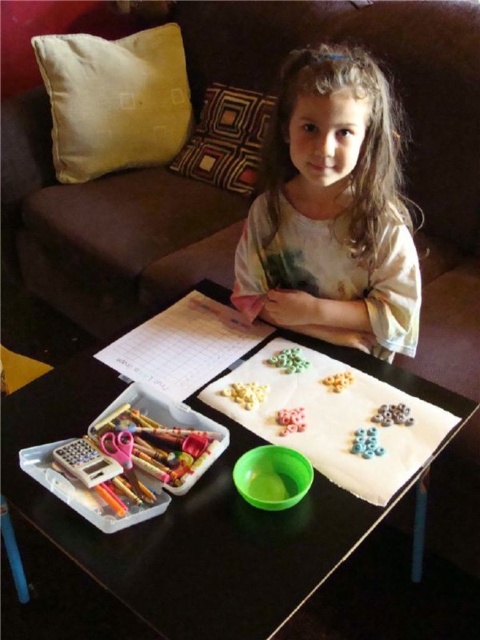
Question: Which point is farther from the camera taking this photo?

Choices:
 (A) (116, 547)
 (B) (372, 346)
 (C) (370, 16)
 (D) (120, 92)

Answer: (D)

Question: In this image, where is velvet brown couch at upper center located relative to green plastic bowl at lower center?

Choices:
 (A) right
 (B) left

Answer: (B)

Question: Which object appears closest to the camera in this image?

Choices:
 (A) beige fabric pillow at upper left
 (B) light brown tie-dye shirt at center
 (C) velvet brown couch at upper center

Answer: (B)

Question: Does green plastic bowl at lower center have a larger size compared to beige fabric pillow at upper left?

Choices:
 (A) yes
 (B) no

Answer: (A)

Question: Which of the following is the farthest from the observer?

Choices:
 (A) velvet brown couch at upper center
 (B) green plastic bowl at lower center
 (C) light brown tie-dye shirt at center

Answer: (A)

Question: Can you confirm if velvet brown couch at upper center is positioned to the right of beige fabric pillow at upper left?

Choices:
 (A) yes
 (B) no

Answer: (B)